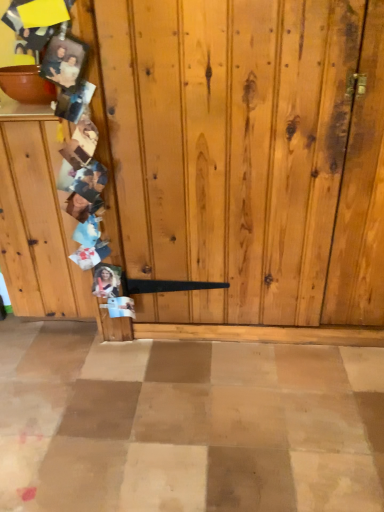
Question: Should I look upward or downward to see wooden photo collage at left?

Choices:
 (A) down
 (B) up

Answer: (B)

Question: Is wooden photo collage at left thinner than matte brown bowl at upper left?

Choices:
 (A) no
 (B) yes

Answer: (A)

Question: Are wooden photo collage at left and matte brown bowl at upper left far apart?

Choices:
 (A) yes
 (B) no

Answer: (B)

Question: Is wooden photo collage at left next to matte brown bowl at upper left and touching it?

Choices:
 (A) yes
 (B) no

Answer: (B)

Question: Does wooden photo collage at left appear on the left side of matte brown bowl at upper left?

Choices:
 (A) no
 (B) yes

Answer: (A)

Question: Is wooden photo collage at left aimed at matte brown bowl at upper left?

Choices:
 (A) no
 (B) yes

Answer: (A)

Question: Is wooden photo collage at left outside matte brown bowl at upper left?

Choices:
 (A) no
 (B) yes

Answer: (B)

Question: Does matte brown bowl at upper left come in front of wooden photo collage at left?

Choices:
 (A) no
 (B) yes

Answer: (A)

Question: Is matte brown bowl at upper left placed right next to wooden photo collage at left?

Choices:
 (A) yes
 (B) no

Answer: (B)

Question: Considering the relative sizes of matte brown bowl at upper left and wooden photo collage at left in the image provided, is matte brown bowl at upper left wider than wooden photo collage at left?

Choices:
 (A) yes
 (B) no

Answer: (B)

Question: From the image's perspective, is matte brown bowl at upper left on wooden photo collage at left?

Choices:
 (A) yes
 (B) no

Answer: (A)

Question: Could you tell me if matte brown bowl at upper left is turned towards wooden photo collage at left?

Choices:
 (A) yes
 (B) no

Answer: (B)

Question: Considering the relative sizes of matte brown bowl at upper left and wooden photo collage at left in the image provided, is matte brown bowl at upper left thinner than wooden photo collage at left?

Choices:
 (A) no
 (B) yes

Answer: (B)

Question: Relative to wooden photo collage at left, is matte brown bowl at upper left in front or behind?

Choices:
 (A) behind
 (B) front

Answer: (A)